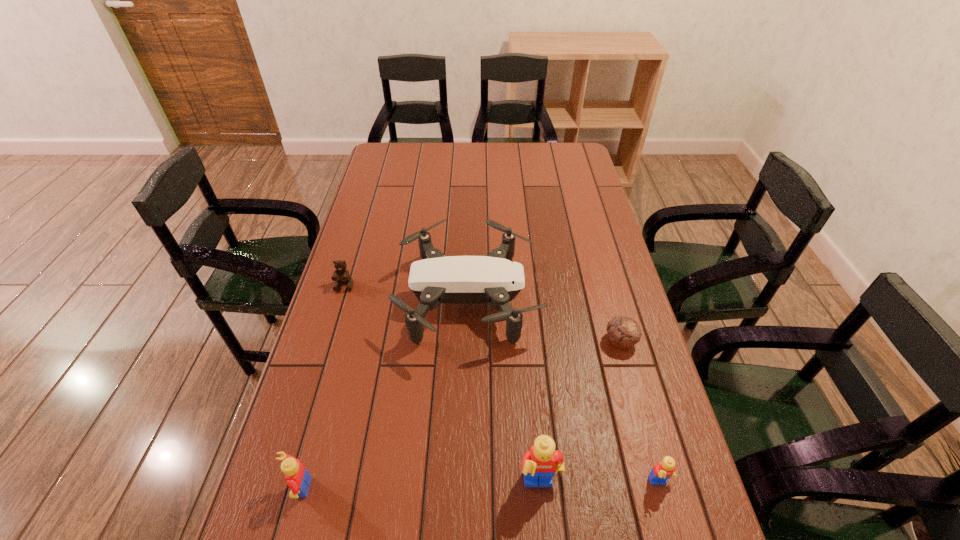
Find the location of a particular element. This screenshot has width=960, height=540. vacant spot for a new Lego to ensure equal spacing is located at coordinates (420, 487).